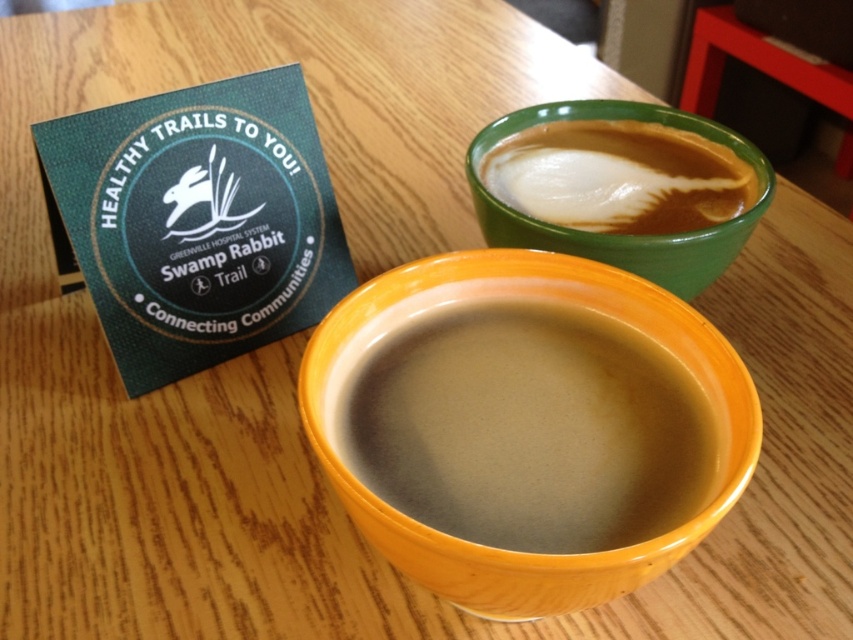
You have a saucer that is 10 cm in diameter. Can the matte ceramic mug at center and the smooth green cup at upper right both fit on the saucer without overlapping?

The matte ceramic mug at center is narrower than the smooth green cup at upper right. Since the saucer is only 10 cm in diameter, both items may not fit without overlapping because their combined widths might exceed the saucer size.